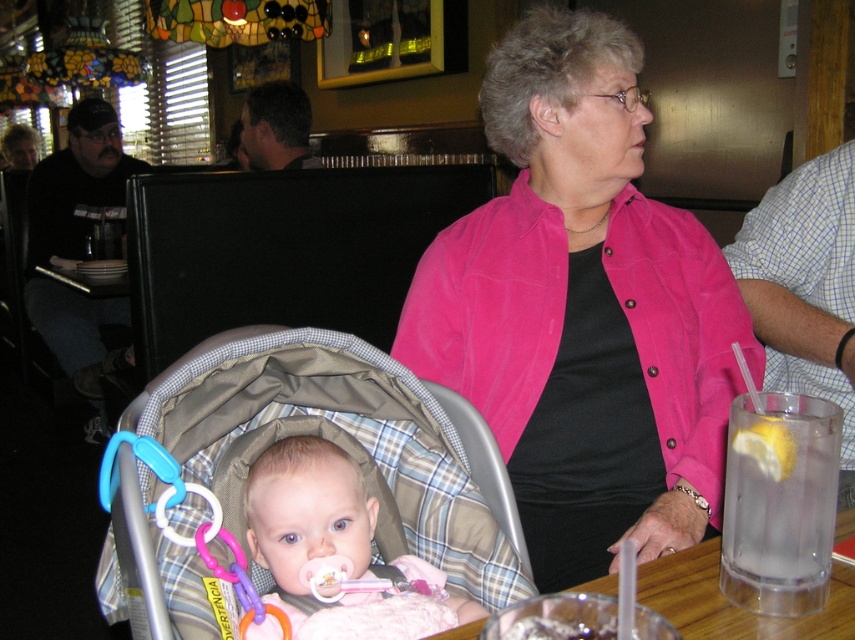
Between plaid fabric baby carriage at center and plastic/soft baby rattle at center, which one is positioned higher?

plaid fabric baby carriage at center

Is plaid fabric baby carriage at center above plastic/soft baby rattle at center?

Correct, plaid fabric baby carriage at center is located above plastic/soft baby rattle at center.

Who is more distant from viewer, (x=437, y=552) or (x=133, y=596)?

The point (x=437, y=552) is more distant.

Find the location of `plaid fabric baby carriage at center`. plaid fabric baby carriage at center is located at coordinates (276, 440).

Can you confirm if pink fabric jacket at center is positioned to the left of pink plastic teething ring at lower center?

Yes, pink fabric jacket at center is to the left of pink plastic teething ring at lower center.

Who is more distant from viewer, (596, 413) or (659, 552)?

The point (596, 413) is behind.

Between point (593, 77) and point (675, 550), which one is positioned behind?

The point (593, 77) is behind.

I want to click on pink fabric jacket at center, so click(x=582, y=310).

Can you confirm if clear glass table at lower center is wider than plastic/soft baby rattle at center?

Yes.

Is clear glass table at lower center to the left of plastic/soft baby rattle at center from the viewer's perspective?

Incorrect, clear glass table at lower center is not on the left side of plastic/soft baby rattle at center.

Does point (694, 596) come farther from viewer compared to point (131, 525)?

No, it is not.

Find the location of a particular element. This screenshot has height=640, width=855. clear glass table at lower center is located at coordinates (733, 604).